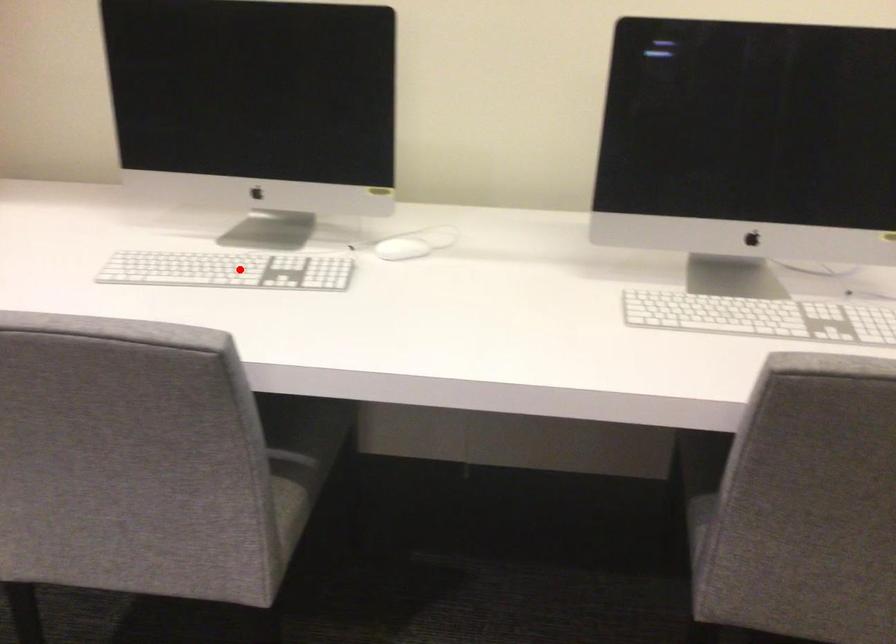
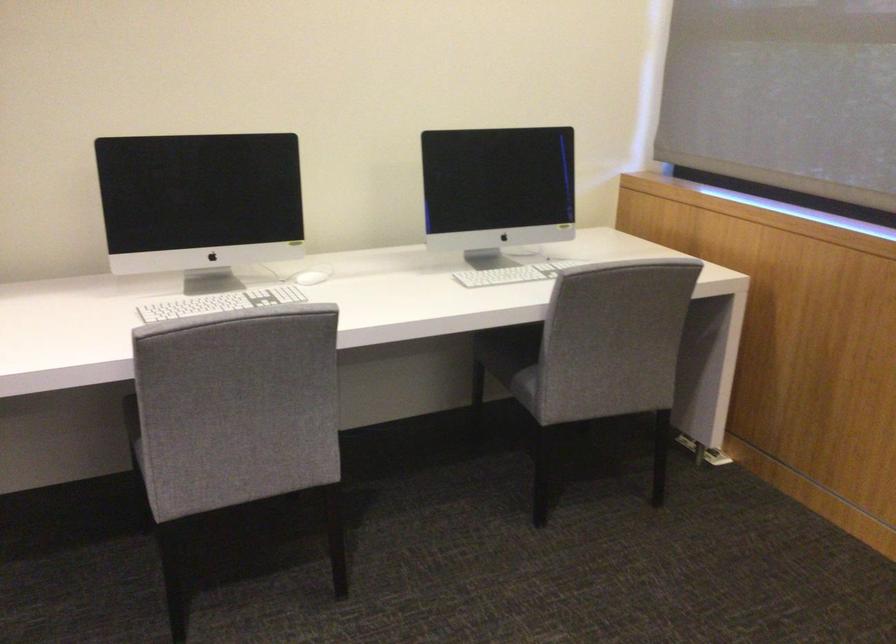
Question: I am providing you with two images of the same scene from different viewpoints. Given a red point in image1, look at the same physical point in image2. Is it:

Choices:
 (A) Closer to the viewpoint
 (B) Farther from the viewpoint

Answer: (B)